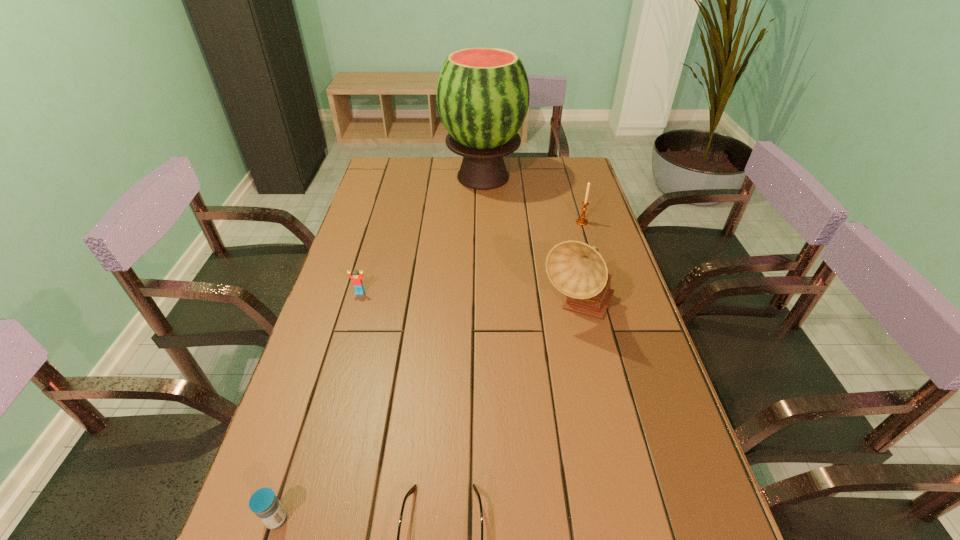
Identify the location of the farthest object. This screenshot has height=540, width=960. (483, 94).

Where is `watermelon`? The height and width of the screenshot is (540, 960). watermelon is located at coordinates (483, 94).

The height and width of the screenshot is (540, 960). In order to click on the second tallest object in this screenshot , I will do `click(576, 269)`.

Where is `candle_holder`? The image size is (960, 540). candle_holder is located at coordinates (581, 221).

This screenshot has width=960, height=540. I want to click on the fourth shortest object, so click(x=581, y=221).

Locate an element on the screen. The height and width of the screenshot is (540, 960). medicine is located at coordinates (264, 503).

Image resolution: width=960 pixels, height=540 pixels. Identify the location of Lego. (357, 279).

The width and height of the screenshot is (960, 540). Identify the location of vacant space located 0.150m on the front of the farthest object. (483, 222).

Identify the location of vacant space located on the horn of the second tallest object. (607, 439).

Find the location of a particular element. This screenshot has height=540, width=960. vacant point located 0.380m on the left of the candle_holder is located at coordinates (465, 222).